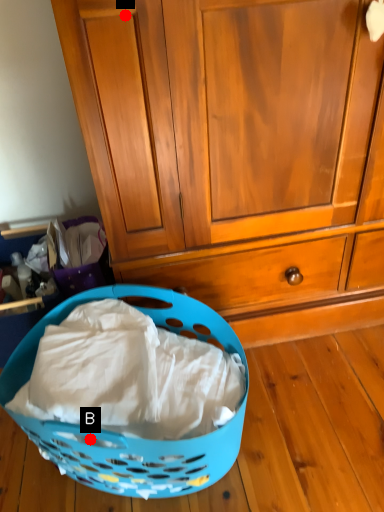
Question: Two points are circled on the image, labeled by A and B beside each circle. Which point appears closest to the camera in this image?

Choices:
 (A) A is closer
 (B) B is closer

Answer: (A)